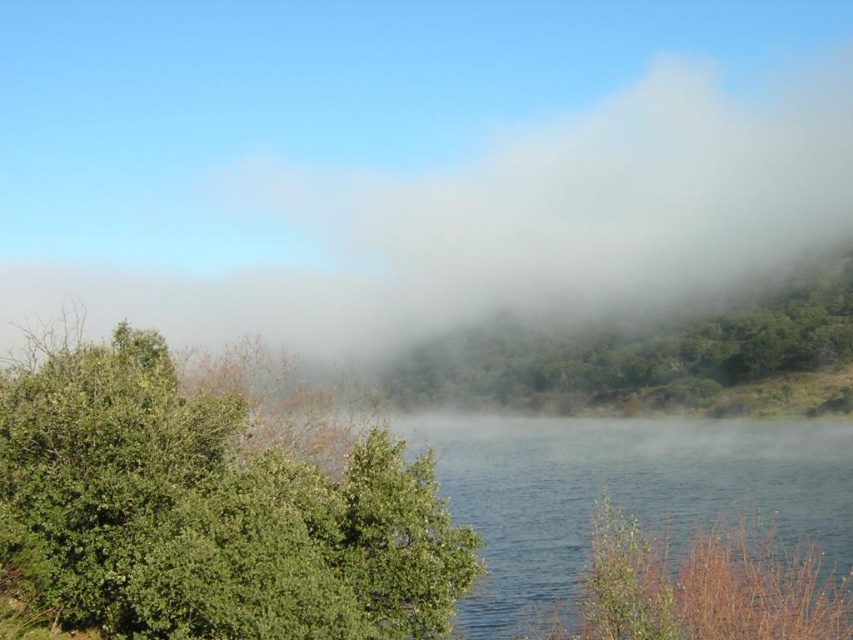
Is the position of white misty fog at upper center less distant than that of green leafy bush at center?

That is False.

Who is positioned more to the right, white misty fog at upper center or green leafy bush at center?

green leafy bush at center is more to the right.

What do you see at coordinates (399, 154) in the screenshot? This screenshot has height=640, width=853. I see `white misty fog at upper center` at bounding box center [399, 154].

Locate an element on the screen. The width and height of the screenshot is (853, 640). white misty fog at upper center is located at coordinates (399, 154).

Which is behind, point (433, 268) or point (764, 355)?

Positioned behind is point (433, 268).

This screenshot has width=853, height=640. What do you see at coordinates (399, 154) in the screenshot?
I see `white misty fog at upper center` at bounding box center [399, 154].

Locate an element on the screen. This screenshot has width=853, height=640. white misty fog at upper center is located at coordinates 399,154.

Is point (6, 406) closer to camera compared to point (512, 480)?

Yes, it is.

Is point (270, 392) closer to camera compared to point (642, 483)?

Yes, point (270, 392) is closer to viewer.

The image size is (853, 640). Identify the location of green leafy bush at center. (212, 500).